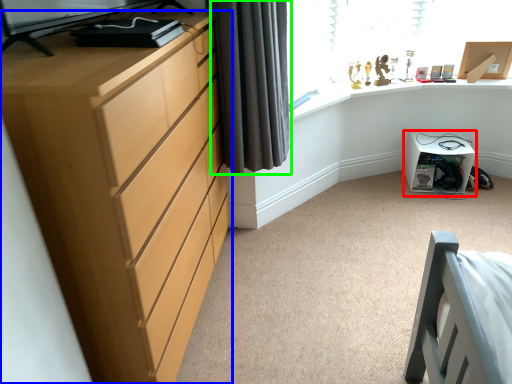
Question: Which is farther away from cabinetry (highlighted by a red box)? chest of drawers (highlighted by a blue box) or curtain (highlighted by a green box)?

Choices:
 (A) chest of drawers
 (B) curtain

Answer: (A)